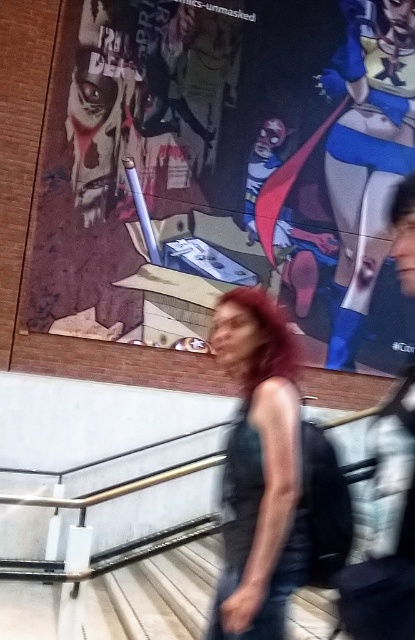
Question: Does matte black tank top at center appear on the left side of wooden stairs at lower center?

Choices:
 (A) no
 (B) yes

Answer: (A)

Question: Which is farther from the wooden stairs at lower center?

Choices:
 (A) matte black tank top at center
 (B) matte paper poster at upper center

Answer: (B)

Question: Considering the real-world distances, which object is farthest from the matte black tank top at center?

Choices:
 (A) matte paper poster at upper center
 (B) wooden stairs at lower center

Answer: (A)

Question: Is matte paper poster at upper center above wooden stairs at lower center?

Choices:
 (A) no
 (B) yes

Answer: (B)

Question: Does matte black tank top at center appear on the left side of wooden stairs at lower center?

Choices:
 (A) no
 (B) yes

Answer: (A)

Question: Which point appears farthest from the camera in this image?

Choices:
 (A) (160, 605)
 (B) (398, 116)
 (C) (268, 378)

Answer: (B)